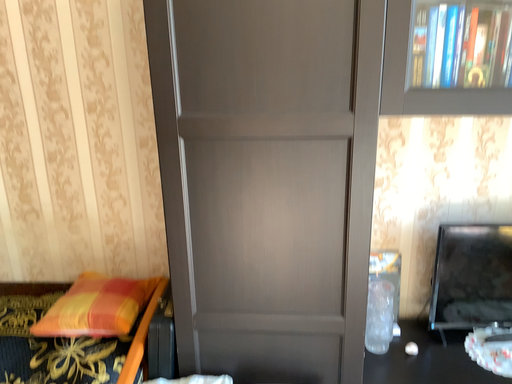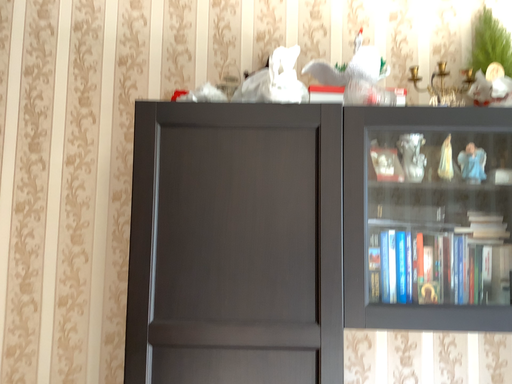
Question: Which way did the camera rotate in the video?

Choices:
 (A) rotated downward
 (B) rotated upward

Answer: (B)